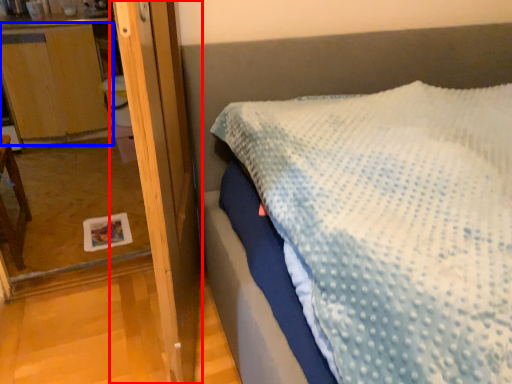
Question: Which object is further to the camera taking this photo, screen door (highlighted by a red box) or dresser (highlighted by a blue box)?

Choices:
 (A) screen door
 (B) dresser

Answer: (B)